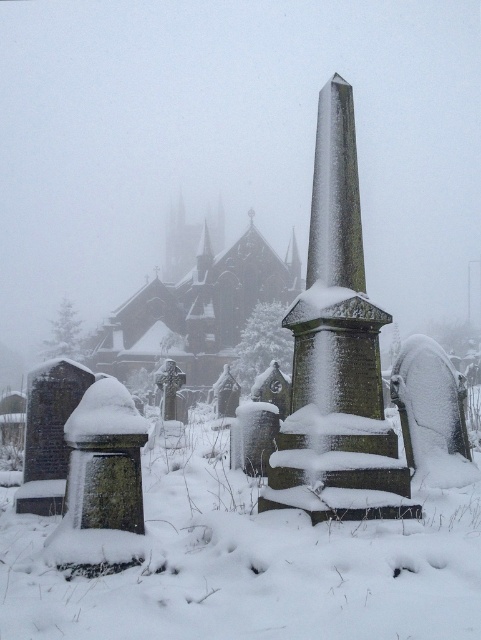
Is dark brown stone church at center thinner than green mossy gravestone at lower left?

Incorrect, dark brown stone church at center's width is not less than green mossy gravestone at lower left's.

Measure the distance between point (168, 317) and camera.

They are 278.97 feet apart.

I want to click on dark brown stone church at center, so click(x=198, y=308).